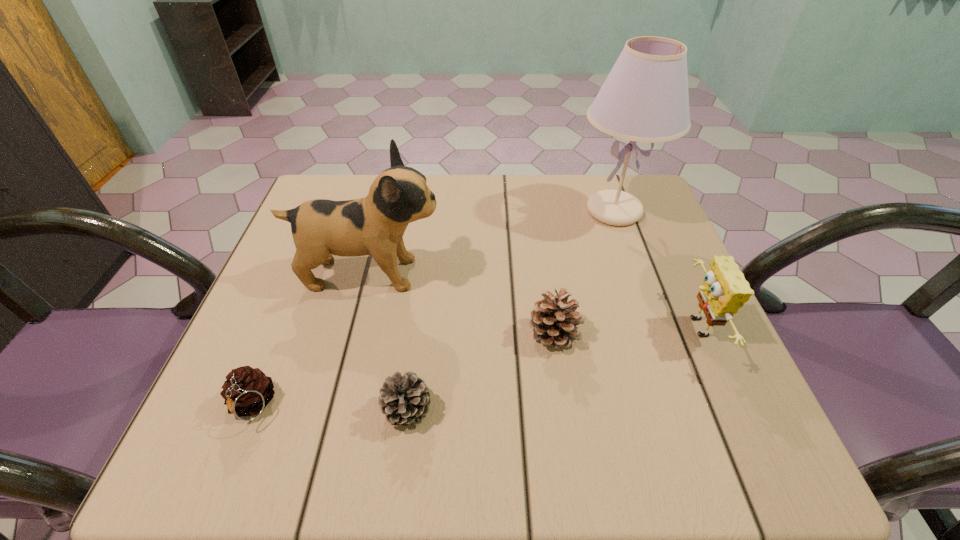
I want to click on the closest pinecone to the lampshade, so click(554, 319).

Locate an element on the screen. Image resolution: width=960 pixels, height=540 pixels. pinecone that is the second closest to the farthest pinecone is located at coordinates (247, 391).

The height and width of the screenshot is (540, 960). What are the coordinates of `free space that satisfies the following two spatial constraints: 1. with a leaf charm attached to the leftmost pinecone; 2. on the right side of the second pinecone from left to right` in the screenshot? It's located at (251, 409).

Locate an element on the screen. free space that satisfies the following two spatial constraints: 1. on the back side of the third object from right to left; 2. at the face of the puppy is located at coordinates (545, 274).

Image resolution: width=960 pixels, height=540 pixels. In order to click on free region that satisfies the following two spatial constraints: 1. on the face of the third tallest object; 2. on the front side of the tallest pinecone in this screenshot , I will do `click(699, 334)`.

Find the location of a particular element. free spot that satisfies the following two spatial constraints: 1. at the face of the puppy; 2. with a leaf charm attached to the leftmost pinecone is located at coordinates (336, 406).

You are a GUI agent. You are given a task and a screenshot of the screen. Output one action in this format:
    pyautogui.click(x=<x>, y=<y>)
    Task: Click on the free region that satisfies the following two spatial constraints: 1. at the face of the puppy; 2. on the back side of the second pinecone from left to right
    This screenshot has height=540, width=960.
    Given the screenshot: What is the action you would take?
    coord(335,409)

Locate an element on the screen. The width and height of the screenshot is (960, 540). vacant space that satisfies the following two spatial constraints: 1. with a leaf charm attached to the second pinecone from left to right; 2. on the left side of the leftmost pinecone is located at coordinates (251, 409).

Where is `vacant space that satisfies the following two spatial constraints: 1. at the face of the puppy; 2. on the right side of the farthest pinecone`? This screenshot has height=540, width=960. vacant space that satisfies the following two spatial constraints: 1. at the face of the puppy; 2. on the right side of the farthest pinecone is located at coordinates (354, 334).

Image resolution: width=960 pixels, height=540 pixels. I want to click on vacant region that satisfies the following two spatial constraints: 1. at the face of the second tallest object; 2. on the right side of the fourth tallest object, so click(x=354, y=334).